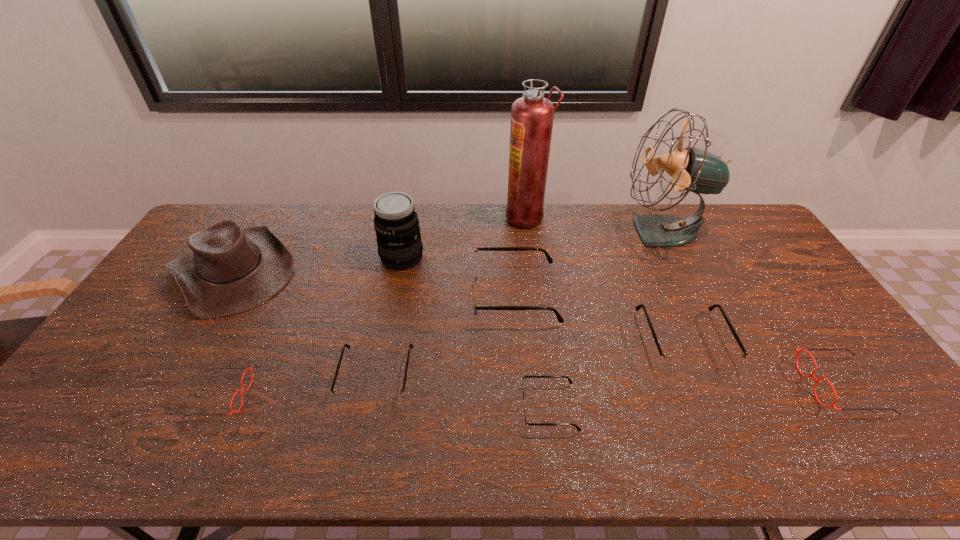
I want to click on vacant space located at the hinge ends of the fifth spectacles from right to left, so tap(365, 435).

I want to click on vacant region located on the front-facing side of the smaller red spectacles, so click(299, 396).

Image resolution: width=960 pixels, height=540 pixels. Find the location of `free location located at the hinge ends of the smallest black spectacles`. free location located at the hinge ends of the smallest black spectacles is located at coordinates (431, 408).

The image size is (960, 540). Find the location of `vacant space located 0.280m at the hinge ends of the smallest black spectacles`. vacant space located 0.280m at the hinge ends of the smallest black spectacles is located at coordinates (407, 408).

What are the coordinates of `vacant region located 0.050m at the hinge ends of the smallest black spectacles` in the screenshot? It's located at pos(500,408).

In order to click on fire extinguisher that is at the far edge in this screenshot , I will do `click(532, 115)`.

Image resolution: width=960 pixels, height=540 pixels. In order to click on fan that is at the far edge in this screenshot , I will do (696, 170).

Locate an element on the screen. cowboy hat present at the far edge is located at coordinates (227, 269).

Identify the location of object situated at the near edge. [527, 423].

Image resolution: width=960 pixels, height=540 pixels. I want to click on object that is positioned at the left edge, so click(227, 269).